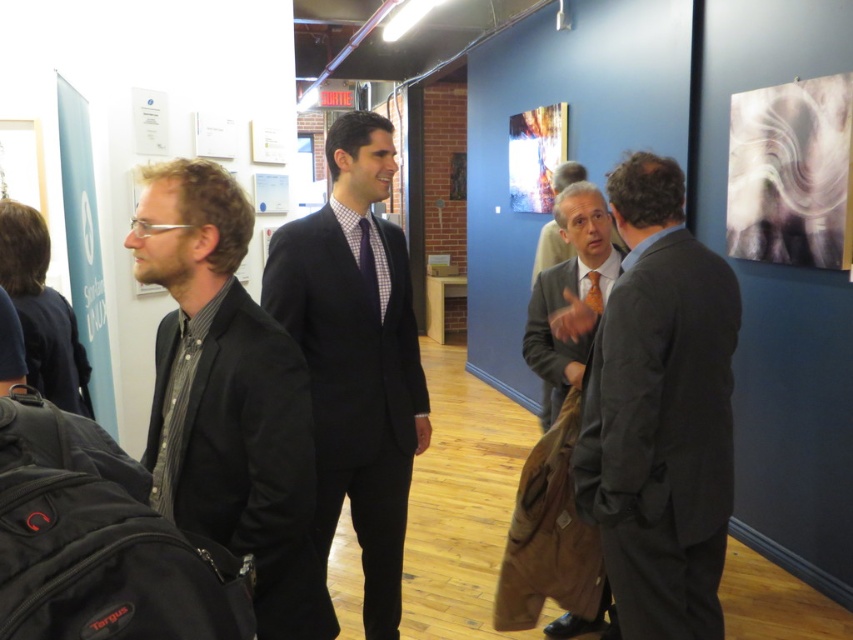
Does matte black suit at center have a lesser height compared to orange silk tie at center?

No.

Can you confirm if matte black suit at center is wider than orange silk tie at center?

Yes, matte black suit at center is wider than orange silk tie at center.

Is point (405, 413) positioned behind point (595, 296)?

That is False.

Where is `matte black suit at center`? matte black suit at center is located at coordinates (357, 356).

Is point (711, 532) farther from viewer compared to point (552, 284)?

No, it is in front of (552, 284).

Is dark gray suit at center thinner than matte gray suit at center?

Incorrect, dark gray suit at center's width is not less than matte gray suit at center's.

Is point (728, 356) closer to camera compared to point (561, 266)?

Yes, it is.

Locate an element on the screen. The height and width of the screenshot is (640, 853). dark gray suit at center is located at coordinates (659, 412).

Does matte black suit at center appear on the right side of checkered fabric tie at center?

In fact, matte black suit at center is to the left of checkered fabric tie at center.

This screenshot has height=640, width=853. What do you see at coordinates (357, 356) in the screenshot? I see `matte black suit at center` at bounding box center [357, 356].

Does point (335, 225) come behind point (363, 269)?

No, it is in front of (363, 269).

The image size is (853, 640). I want to click on matte black suit at center, so [x=357, y=356].